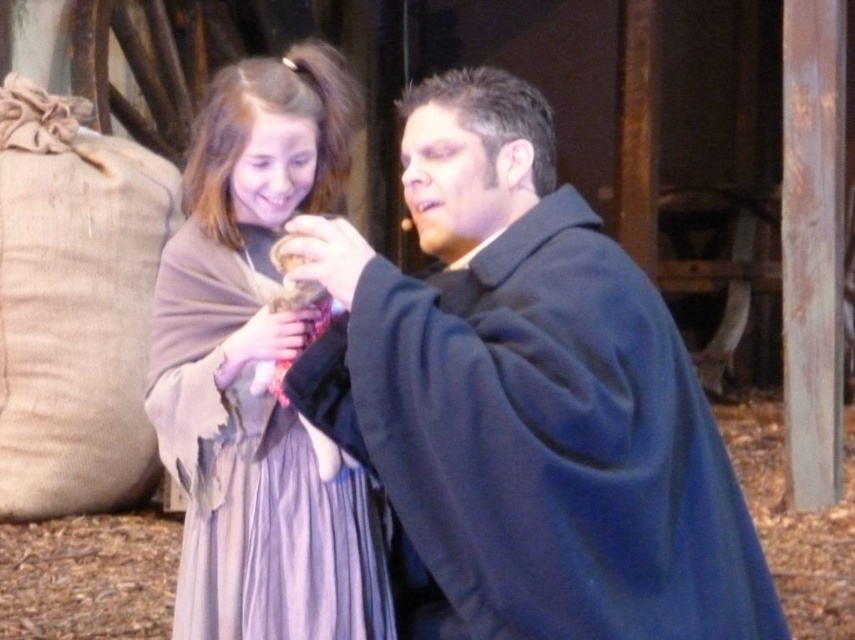
Question: Which of the following is the closest to the observer?

Choices:
 (A) dark blue woolen robe at center
 (B) light brown woolen shawl at center

Answer: (A)

Question: Does dark blue woolen robe at center appear over light brown woolen shawl at center?

Choices:
 (A) no
 (B) yes

Answer: (A)

Question: Is dark blue woolen robe at center positioned before light brown woolen shawl at center?

Choices:
 (A) no
 (B) yes

Answer: (B)

Question: Does dark blue woolen robe at center appear under light brown woolen shawl at center?

Choices:
 (A) no
 (B) yes

Answer: (B)